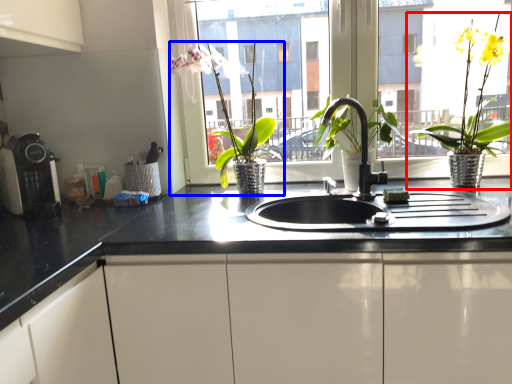
Question: Which object is further to the camera taking this photo, houseplant (highlighted by a red box) or houseplant (highlighted by a blue box)?

Choices:
 (A) houseplant
 (B) houseplant

Answer: (B)